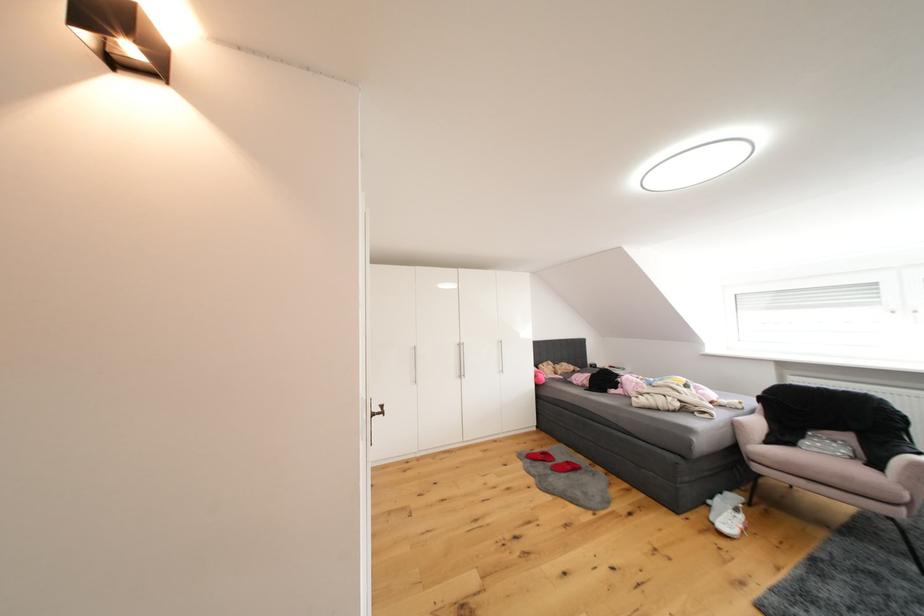
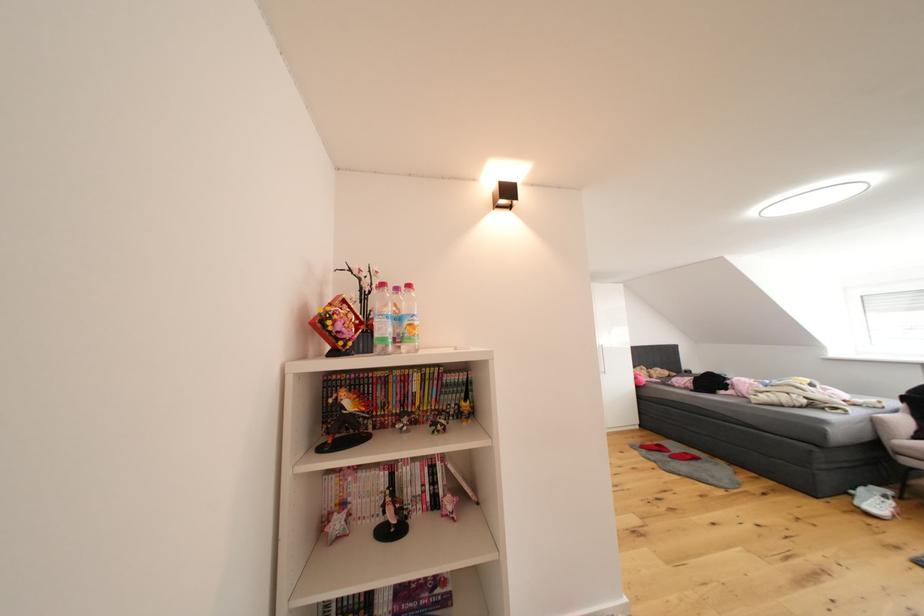
Which direction would the cameraman need to move to produce the second image?

The cameraman walked toward left, backward.